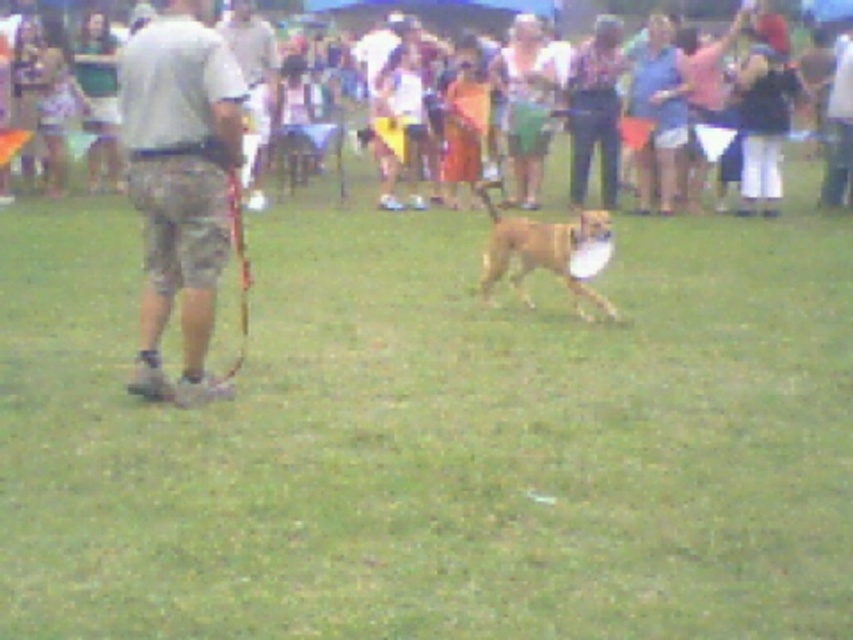
Can you confirm if matte brown dog at center is positioned to the right of brown furry dog at center?

Incorrect, matte brown dog at center is not on the right side of brown furry dog at center.

Can you confirm if matte brown dog at center is wider than brown furry dog at center?

Correct, the width of matte brown dog at center exceeds that of brown furry dog at center.

Is point (282, 3) positioned after point (572, 236)?

Yes, it is behind point (572, 236).

Where is `matte brown dog at center`? matte brown dog at center is located at coordinates (410, 12).

Which is above, camouflage shorts at left or brown furry dog at center?

camouflage shorts at left is above.

Is point (213, 100) positioned behind point (532, 236)?

That is False.

Locate an element on the screen. The width and height of the screenshot is (853, 640). camouflage shorts at left is located at coordinates (178, 182).

Does camouflage shorts at left have a lesser width compared to matte brown dog at center?

Yes.

Between camouflage shorts at left and matte brown dog at center, which one is positioned lower?

camouflage shorts at left

Where is `camouflage shorts at left`? camouflage shorts at left is located at coordinates (178, 182).